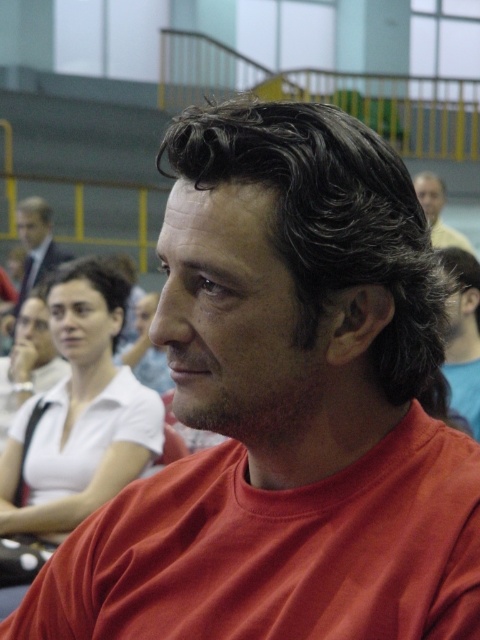
You are standing in the conference room and want to take a photo of both the point at coordinates (24, 214) and the point at coordinates (439, 220). Which point should you focus on first to ensure both are in focus?

You should focus on the point at coordinates (24, 214) first because it is closer to the camera than the point at coordinates (439, 220). By focusing on the closer point, both points will be in focus due to the depth of field.

You are organizing a photo shoot and need to position two models based on their clothing. You have a white matte shirt at center and a matte black suit at upper left. According to the scene, where should each model stand relative to each other to match the original image?

The white matte shirt at center should be positioned below the matte black suit at upper left to match the original image.

You are standing in the conference room and want to locate the matte red shirt at center. According to the coordinates provided, where should you look relative to the center of the image?

The matte red shirt at center is located at point coordinates of 0.523 on the x axis and 0.965 on the y axis, so you should look slightly to the right and upwards from the center of the image.